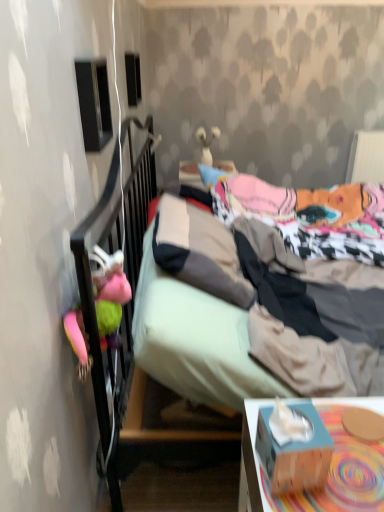
Question: Is blue cardboard tissue box at lower right to the left or to the right of textured fabric bed at center in the image?

Choices:
 (A) left
 (B) right

Answer: (A)

Question: Is point (274, 488) positioned closer to the camera than point (223, 162)?

Choices:
 (A) farther
 (B) closer

Answer: (B)

Question: Estimate the real-world distances between objects in this image. Which object is farther from the multicolored plush toy at left, the 2th toy when ordered from back to front?

Choices:
 (A) blue cardboard tissue box at lower right
 (B) black plastic speaker at upper center, positioned as the first loudspeaker in back-to-front order
 (C) textured fabric bed at center
 (D) white glossy vase at upper center, which is the 2th toy from left to right
 (E) black matte speaker at upper left, arranged as the 2th loudspeaker when viewed from the top

Answer: (D)

Question: Which object is the farthest from the textured fabric bed at center?

Choices:
 (A) multicolored plush toy at left, the 2th toy when ordered from back to front
 (B) white glossy vase at upper center, the first toy positioned from the back
 (C) black plastic speaker at upper center, acting as the first loudspeaker starting from the top
 (D) black matte speaker at upper left, positioned as the 2th loudspeaker in back-to-front order
 (E) wooden tissue box at lower right

Answer: (B)